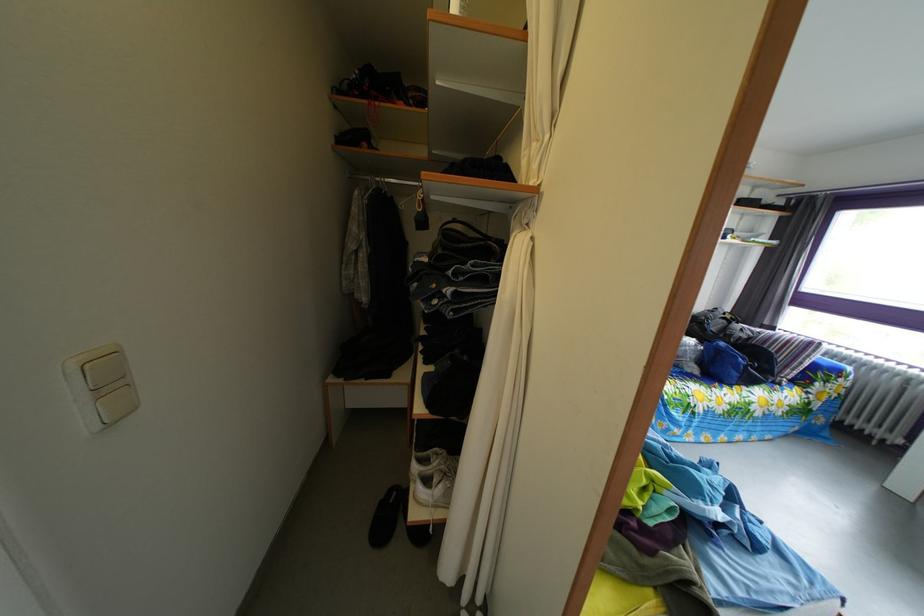
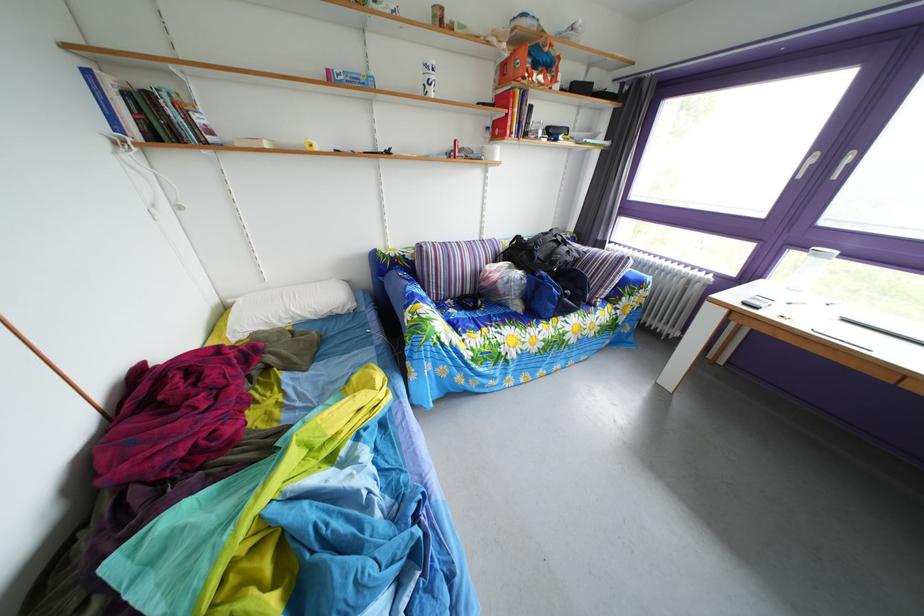
Which direction would the cameraman need to move to produce the second image?

The movement direction of the cameraman is right, forward.